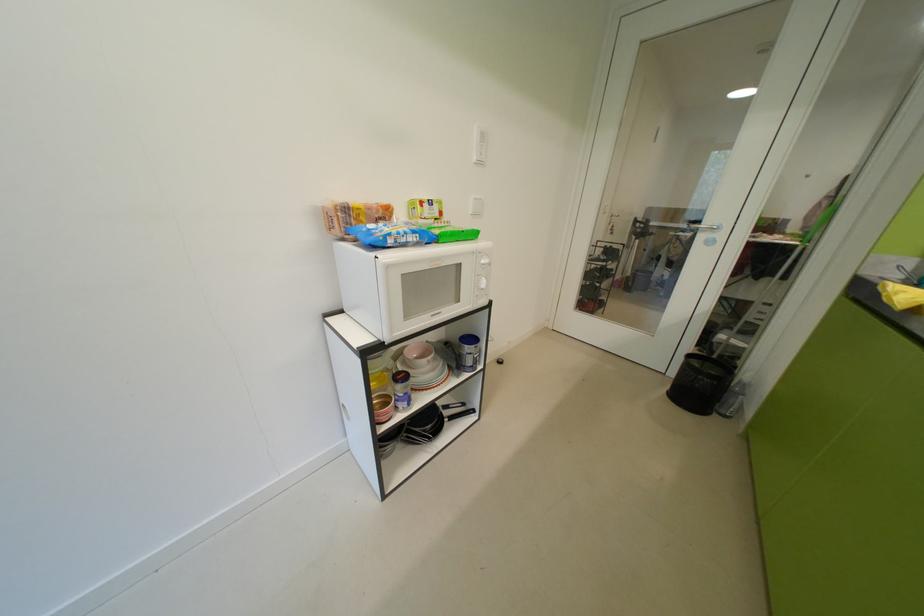
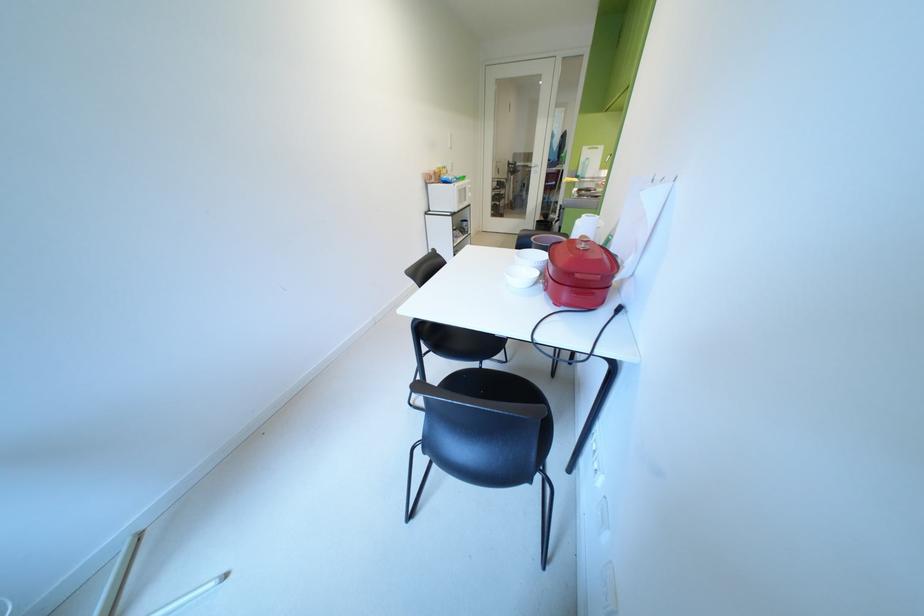
What movement of the cameraman would produce the second image?

The cameraman moved toward left, backward.